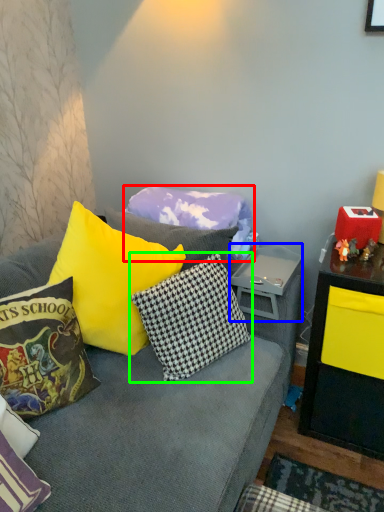
Question: Which object is positioned farthest from pillow (highlighted by a red box)? Select from side table (highlighted by a blue box) and pillow (highlighted by a green box).

Choices:
 (A) side table
 (B) pillow

Answer: (B)